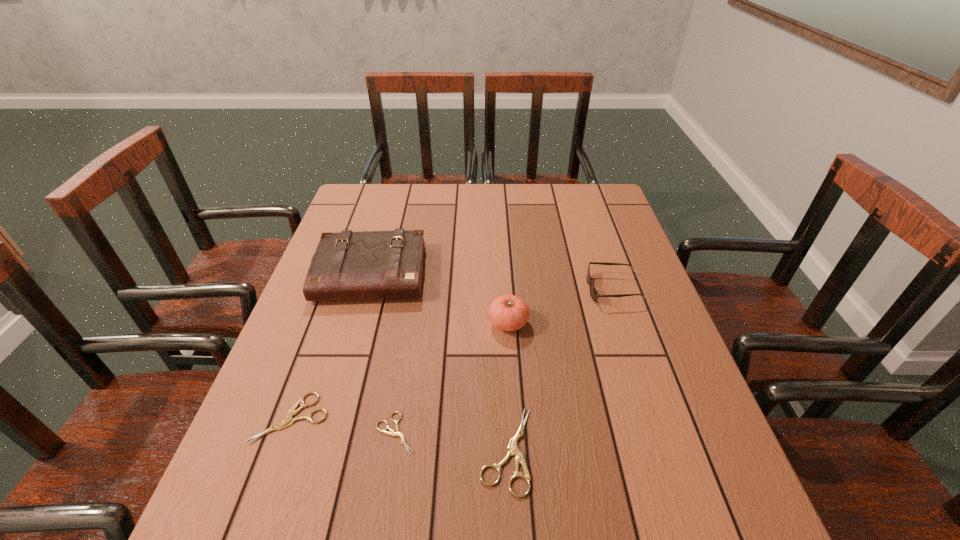
Given the evenly spaced shearss in the image, where should an extra shears be added on the right to preserve the spacing? Please point to a vacant space. Please provide its 2D coordinates. Your answer should be formatted as a tuple, i.e. [(x, y)], where the tuple contains the x and y coordinates of a point satisfying the conditions above.

[(624, 468)]